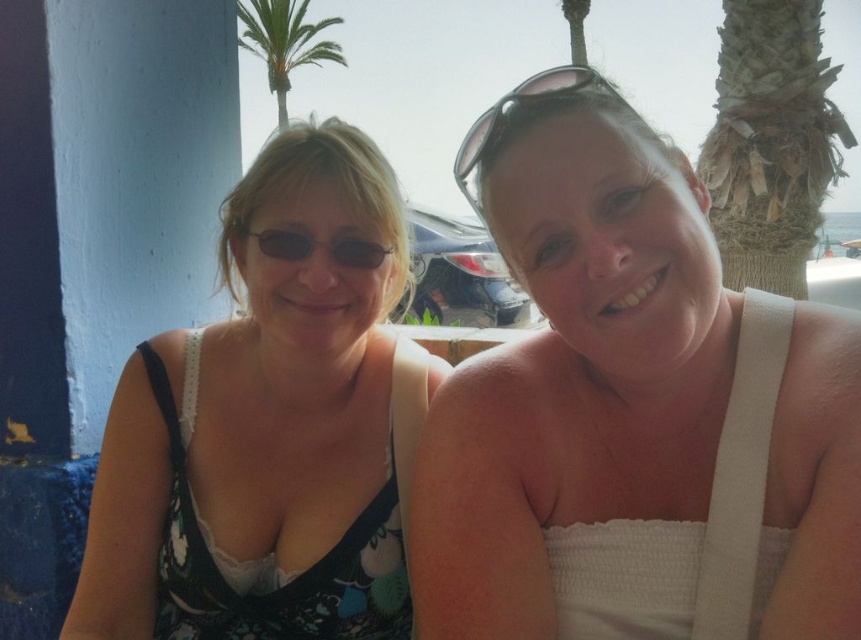
From the picture: Between white textured top at center and floral fabric dress at left, which one appears on the left side from the viewer's perspective?

Positioned to the left is floral fabric dress at left.

Where is `white textured top at center`? The height and width of the screenshot is (640, 861). white textured top at center is located at coordinates (632, 410).

What do you see at coordinates (632, 410) in the screenshot? The image size is (861, 640). I see `white textured top at center` at bounding box center [632, 410].

In order to click on white textured top at center in this screenshot , I will do `click(632, 410)`.

Between point (579, 65) and point (362, 259), which one is positioned in front?

Point (579, 65) is more forward.

Who is positioned more to the left, sunglasses at upper right or matte black sunglasses at center?

matte black sunglasses at center

Is point (548, 68) farther from viewer compared to point (289, 240)?

Yes.

Where is `sunglasses at upper right`? sunglasses at upper right is located at coordinates (518, 118).

Can you confirm if green leafy palm tree at upper center is positioned above sunglasses at upper right?

Yes.

Who is more distant from viewer, (x=283, y=68) or (x=465, y=188)?

Positioned behind is point (x=283, y=68).

Identify the location of green leafy palm tree at upper center. (283, 42).